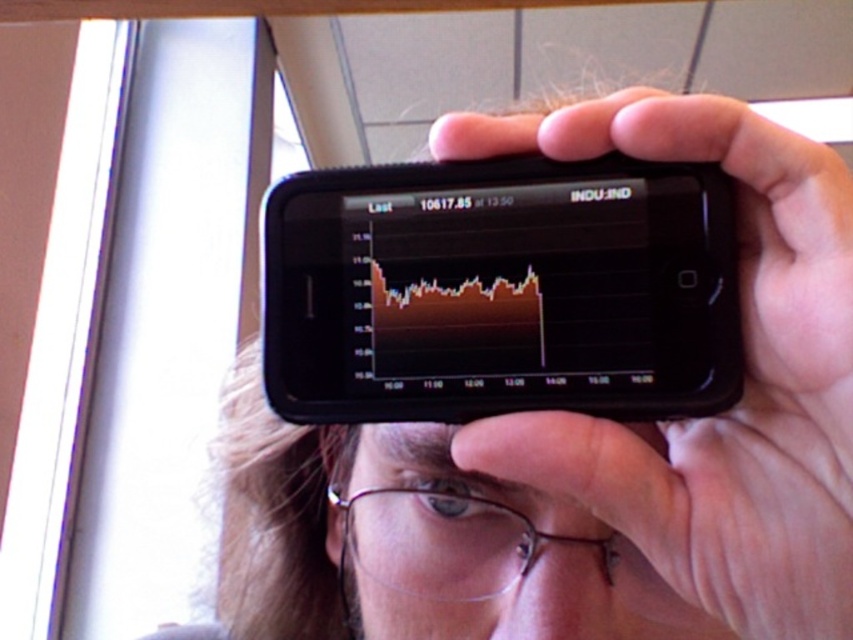
Does black plastic smartphone at upper center have a lesser height compared to black matte phone at upper center?

Yes, black plastic smartphone at upper center is shorter than black matte phone at upper center.

Which of these two, black plastic smartphone at upper center or black matte phone at upper center, stands taller?

With more height is black matte phone at upper center.

Which is behind, point (378, 234) or point (703, 97)?

Point (378, 234)

The width and height of the screenshot is (853, 640). I want to click on black plastic smartphone at upper center, so click(500, 291).

Describe the element at coordinates (747, 381) in the screenshot. I see `black matte phone at upper center` at that location.

Is point (759, 554) farther from camera compared to point (340, 554)?

No, (759, 554) is closer to viewer.

Where is `black matte phone at upper center`? This screenshot has height=640, width=853. black matte phone at upper center is located at coordinates (747, 381).

Which is behind, point (399, 292) or point (442, 570)?

The point (442, 570) is behind.

Is point (577, 360) positioned in front of point (531, 547)?

Yes, point (577, 360) is closer to viewer.

What do you see at coordinates (500, 291) in the screenshot?
I see `black plastic smartphone at upper center` at bounding box center [500, 291].

This screenshot has width=853, height=640. Find the location of `black plastic smartphone at upper center`. black plastic smartphone at upper center is located at coordinates (500, 291).